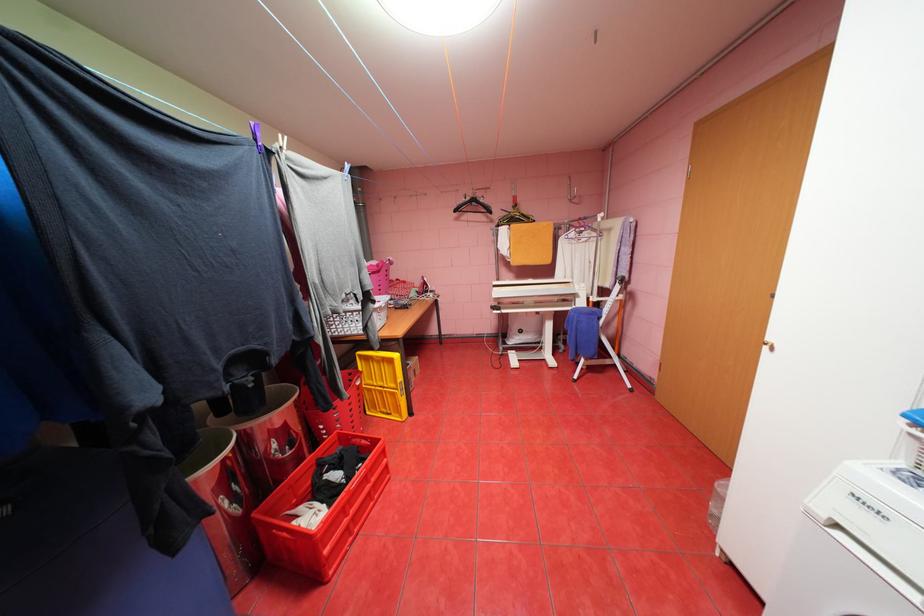
I want to click on ironing press handle, so click(877, 519).